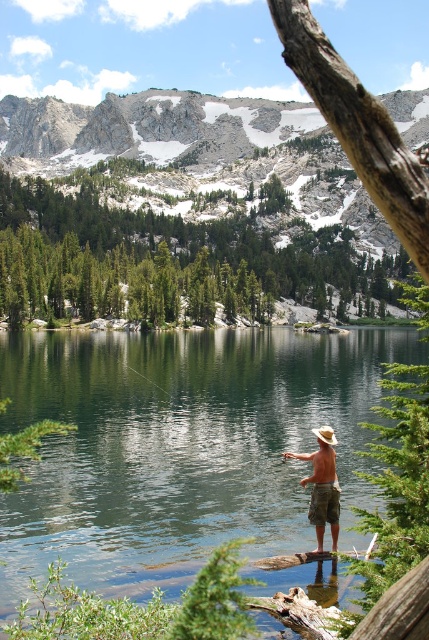
You are a photographer planning to capture a reflection of the clear water at center and the tan canvas hat at center in the lake. Since reflections depend on the object height above the water, which object would have a more complete reflection in the lake?

The clear water at center is taller than the tan canvas hat at center, so the tan canvas hat at center would have a more complete reflection in the lake because shorter objects are more likely to be fully reflected.

You are a photographer planning to take a landscape photo of the green textured pine trees at upper center and the tan canvas hat at center. Which object should you focus on first if you want to capture both in sharp focus?

The green textured pine trees at upper center is bigger than the tan canvas hat at center, so you should focus on the green textured pine trees at upper center first to ensure both are in sharp focus.